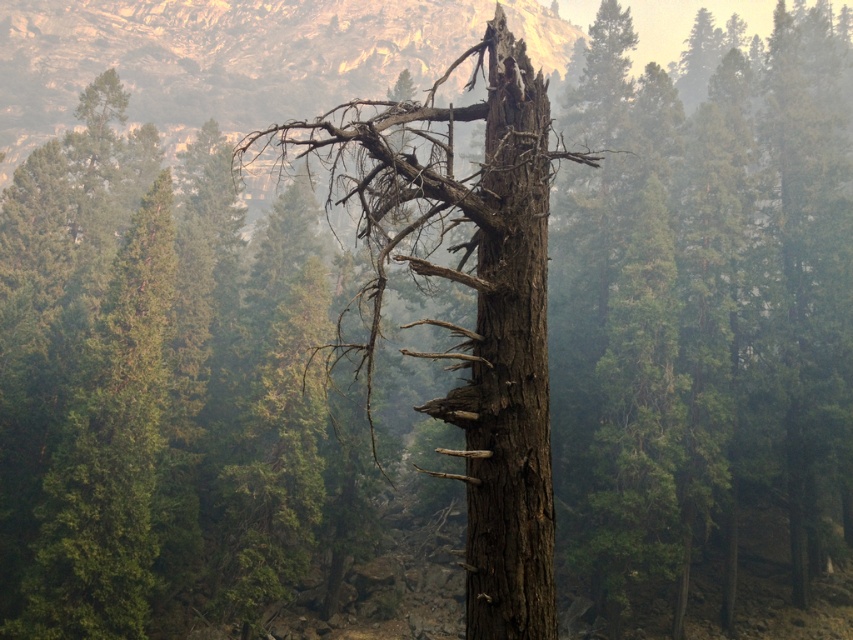
Can you confirm if brown rough bark tree at center is thinner than dark brown rough bark tree trunk at center?

No.

Is brown rough bark tree at center above dark brown rough bark tree trunk at center?

Yes, brown rough bark tree at center is above dark brown rough bark tree trunk at center.

Is point (415, 234) in front of point (489, 376)?

No, it is not.

Where is `brown rough bark tree at center`? The width and height of the screenshot is (853, 640). brown rough bark tree at center is located at coordinates (476, 301).